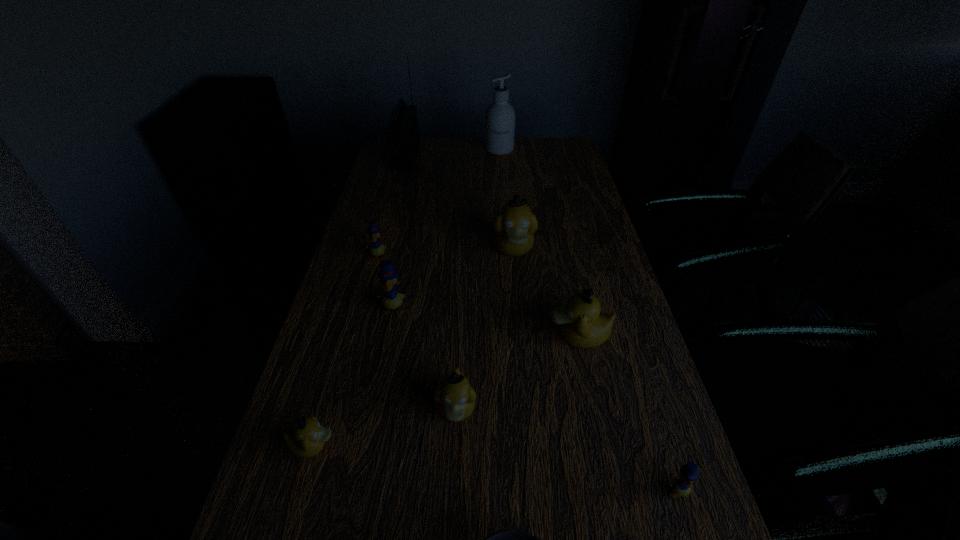
Find the location of a particular element. vacant area that lies between the tallest duckling and the rightmost yellow duckling is located at coordinates (595, 370).

Identify which object is the nearest to the second tan duckling from left to right. Please provide its 2D coordinates. Your answer should be formatted as a tuple, i.e. [(x, y)], where the tuple contains the x and y coordinates of a point satisfying the conditions above.

[(307, 439)]

Identify which object is the closest to the bowl. Please provide its 2D coordinates. Your answer should be formatted as a tuple, i.e. [(x, y)], where the tuple contains the x and y coordinates of a point satisfying the conditions above.

[(455, 398)]

Locate which duckling ranks sixth in proximity to the smallest tan duckling. Please provide its 2D coordinates. Your answer should be formatted as a tuple, i.e. [(x, y)], where the tuple contains the x and y coordinates of a point satisfying the conditions above.

[(681, 485)]

I want to click on duckling that is the sixth closest to the third tan duckling from right to left, so click(x=376, y=249).

The height and width of the screenshot is (540, 960). I want to click on the closest tan duckling to the farthest tan duckling, so click(583, 326).

Find the location of `the second closest tan duckling to the fifth farthest object`. the second closest tan duckling to the fifth farthest object is located at coordinates (515, 225).

Find the location of a particular element. Image resolution: width=960 pixels, height=540 pixels. yellow duckling that is the closest to the third duckling from left to right is located at coordinates (376, 249).

Identify the location of yellow duckling object that ranks as the closest to the nearest object. (681, 485).